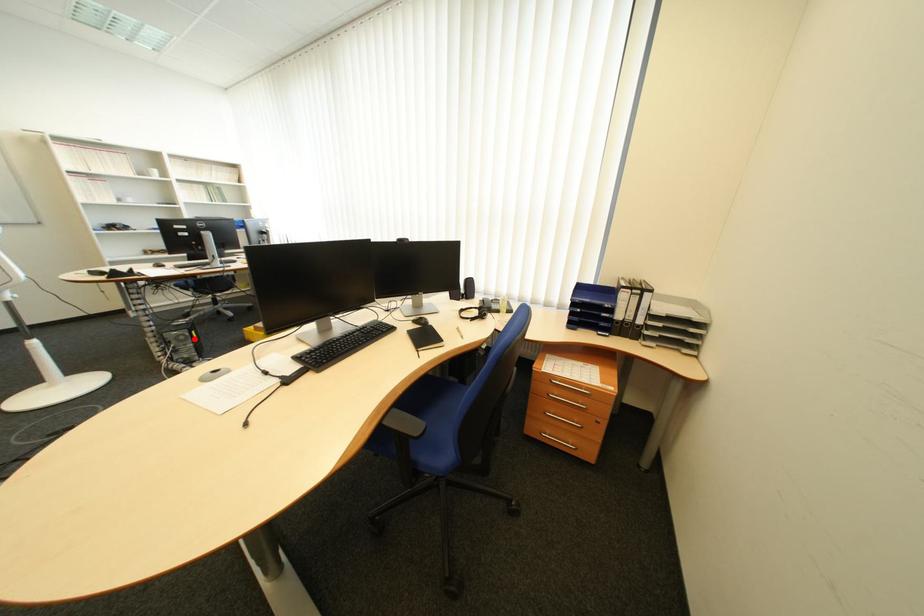
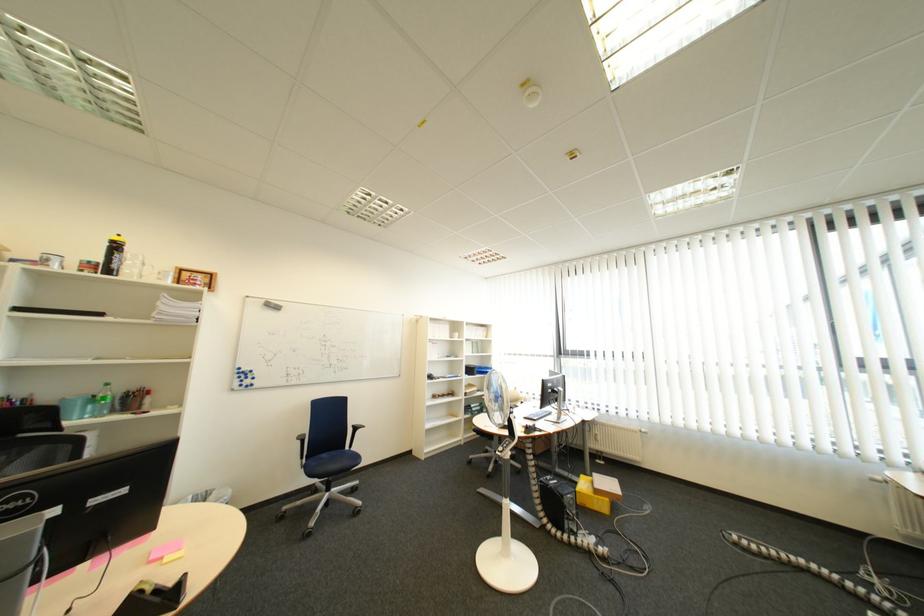
Find the pixel in the second image that matches the highlighted location in the first image.

(585, 503)